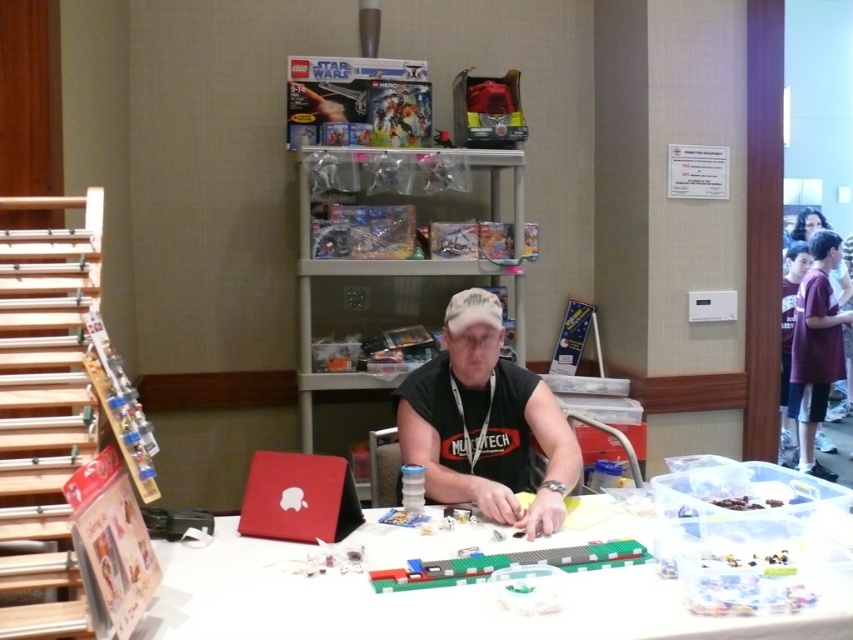
Is point (625, 614) closer to viewer compared to point (265, 513)?

That is True.

Is white plastic table at center positioned at the back of matte red laptop at center?

That is False.

Who is more distant from viewer, (x=270, y=621) or (x=314, y=465)?

The point (x=314, y=465) is behind.

The image size is (853, 640). What are the coordinates of `white plastic table at center` in the screenshot? It's located at (428, 602).

Who is positioned more to the right, matte red laptop at center or black hair at upper right?

Positioned to the right is black hair at upper right.

Can you confirm if matte red laptop at center is wider than black hair at upper right?

In fact, matte red laptop at center might be narrower than black hair at upper right.

The image size is (853, 640). What are the coordinates of `matte red laptop at center` in the screenshot? It's located at (299, 497).

Between white plastic table at center and black matte shirt at center, which one has less height?

Standing shorter between the two is white plastic table at center.

Is point (216, 593) less distant than point (439, 442)?

Yes, point (216, 593) is closer to viewer.

Does point (247, 625) lie behind point (503, 444)?

No, it is in front of (503, 444).

At what (x,y) coordinates should I click in order to perform the action: click on white plastic table at center. Please return your answer as a coordinate pair (x, y). The height and width of the screenshot is (640, 853). Looking at the image, I should click on [428, 602].